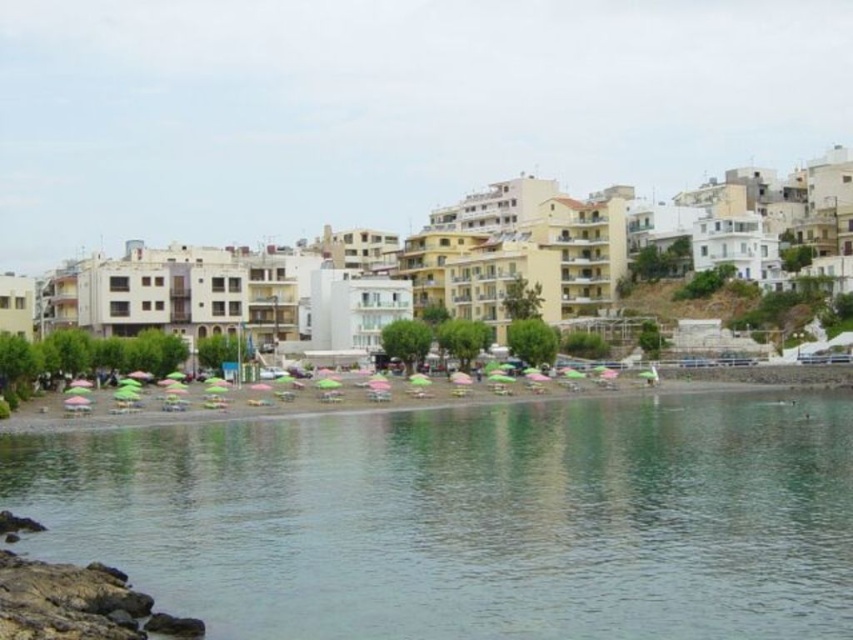
You are standing on the beach and want to walk towards the clear water at lower center. However, there are green umbrellas at lower center blocking your path. Can you walk around them without stepping into the water?

The clear water at lower center has a lesser width compared to the green umbrellas at lower center, meaning the umbrellas are wider. Since the umbrellas are wider, there might not be enough space on either side to walk around them without entering the water. Therefore, it might be challenging to walk around the green umbrellas at lower center without stepping into the water.